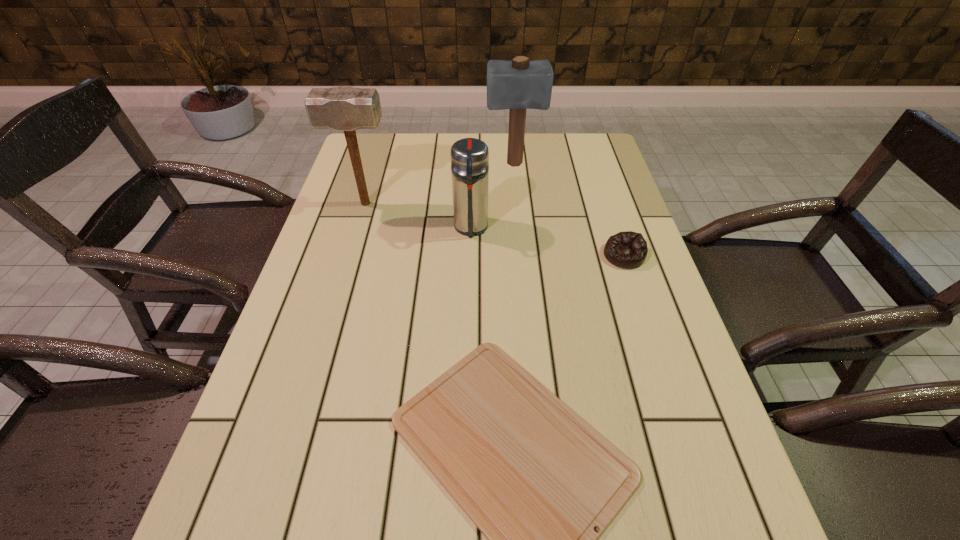
The width and height of the screenshot is (960, 540). Find the location of `free spot between the beanbag and the nearer mallet`. free spot between the beanbag and the nearer mallet is located at coordinates (494, 230).

Where is `vacant space in between the beanbag and the thermos bottle`? The width and height of the screenshot is (960, 540). vacant space in between the beanbag and the thermos bottle is located at coordinates (547, 241).

In order to click on empty space that is in between the beanbag and the second farthest object in this screenshot , I will do `click(494, 230)`.

Find the location of a particular element. Image resolution: width=960 pixels, height=540 pixels. vacant space in between the right mallet and the third shortest object is located at coordinates (492, 196).

Find the location of a particular element. The width and height of the screenshot is (960, 540). vacant space in between the third shortest object and the fourth tallest object is located at coordinates (547, 241).

The height and width of the screenshot is (540, 960). I want to click on object that is the fourth closest to the right mallet, so click(x=535, y=478).

Identify which object is the closest to the leftmost object. Please provide its 2D coordinates. Your answer should be formatted as a tuple, i.e. [(x, y)], where the tuple contains the x and y coordinates of a point satisfying the conditions above.

[(469, 157)]

Locate an element on the screen. This screenshot has height=540, width=960. free location that satisfies the following two spatial constraints: 1. on the front side of the right mallet; 2. on the striking face of the nearer mallet is located at coordinates (517, 204).

Locate an element on the screen. free point that satisfies the following two spatial constraints: 1. with a handle on the side of the fourth tallest object; 2. on the right side of the thermos bottle is located at coordinates (470, 255).